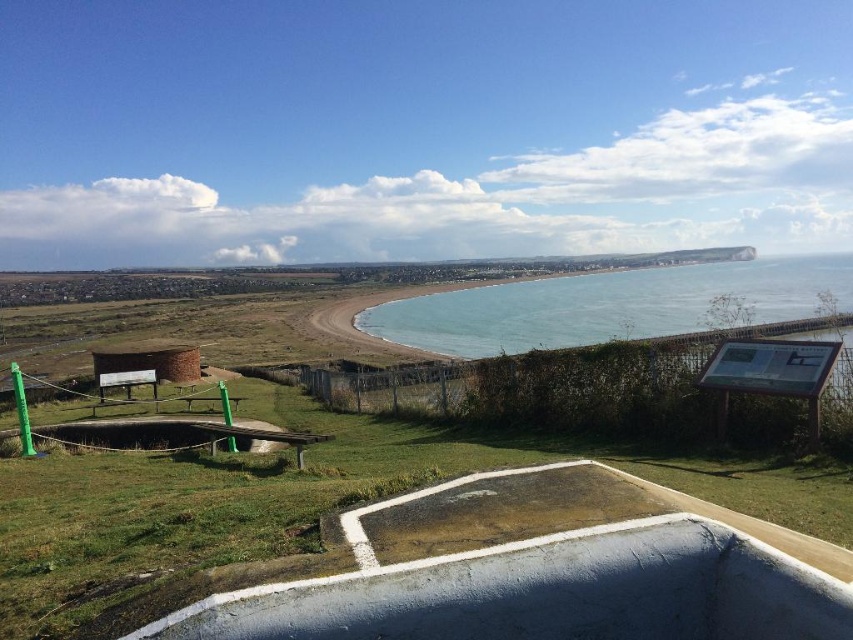
From the picture: You are standing at the edge of the green grassy at lower left and want to walk to the blue water at center. According to the scene description, is the path clear between these two areas?

The green grassy at lower left is in front of blue water at center, so there is a clear path between them.

You are planning to set up a picnic area. The green grassy at lower left and blue water at center are both options. Which area has a larger space available for setting up the picnic?

The blue water at center has a larger space available because the green grassy at lower left is narrower than the blue water at center.